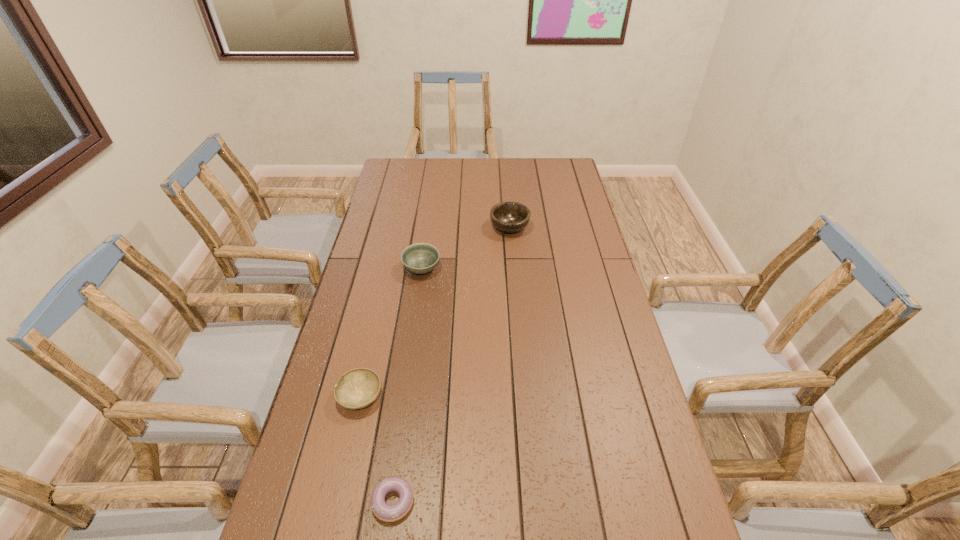
Where is `blank area located on the left of the doughnut`? blank area located on the left of the doughnut is located at coordinates (293, 501).

Find the location of a particular element. object that is at the left edge is located at coordinates (358, 388).

Where is `free space at the left edge of the desktop`? The image size is (960, 540). free space at the left edge of the desktop is located at coordinates (296, 538).

Identify the location of vacant space at the right edge. (620, 345).

Locate an element on the screen. The height and width of the screenshot is (540, 960). free space at the far left corner of the desktop is located at coordinates (392, 165).

Image resolution: width=960 pixels, height=540 pixels. I want to click on free space at the far right corner of the desktop, so click(567, 161).

The height and width of the screenshot is (540, 960). Find the location of `free area in between the third nearest object and the nearest bowl`. free area in between the third nearest object and the nearest bowl is located at coordinates (391, 333).

Where is `free area in between the second farthest object and the nearest object`? free area in between the second farthest object and the nearest object is located at coordinates (407, 385).

Find the location of `unoccupied position between the second farthest object and the doughnut`. unoccupied position between the second farthest object and the doughnut is located at coordinates (407, 385).

In order to click on vacant space that's between the second nearest bowl and the nearest bowl in this screenshot , I will do `click(391, 333)`.